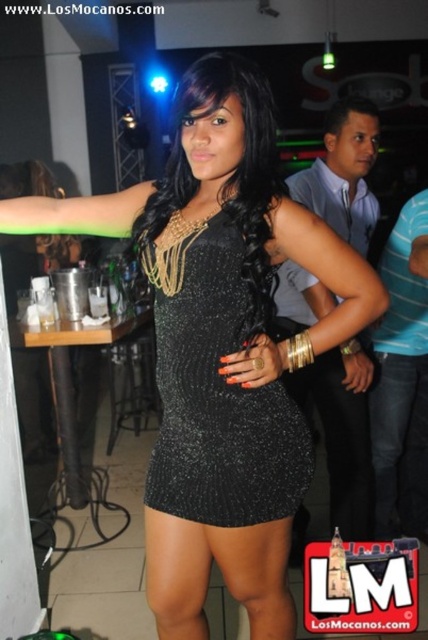
Can you confirm if black sequined dress at center is positioned to the left of denim at right?

Yes, black sequined dress at center is to the left of denim at right.

Is black sequined dress at center wider than denim at right?

Yes.

The image size is (428, 640). I want to click on black sequined dress at center, so click(216, 388).